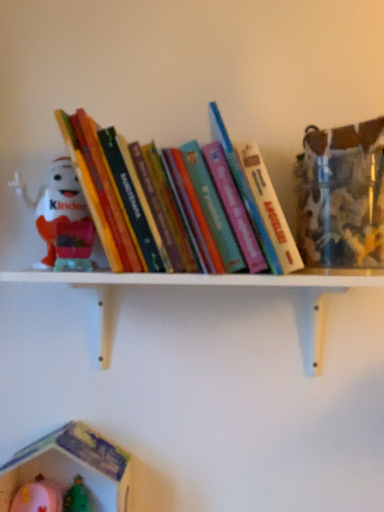
Question: From a real-world perspective, is white wooden shelf at upper center on matte plastic kinder egg at left, positioned as the 2th toy in bottom-to-top order?

Choices:
 (A) yes
 (B) no

Answer: (B)

Question: Considering the relative sizes of white wooden shelf at upper center and matte plastic kinder egg at left, positioned as the 2th toy in bottom-to-top order, in the image provided, is white wooden shelf at upper center taller than matte plastic kinder egg at left, positioned as the 2th toy in bottom-to-top order,?

Choices:
 (A) no
 (B) yes

Answer: (A)

Question: Considering the relative positions of white wooden shelf at upper center and matte plastic kinder egg at left, the 1th toy when ordered from top to bottom, in the image provided, is white wooden shelf at upper center in front of matte plastic kinder egg at left, the 1th toy when ordered from top to bottom,?

Choices:
 (A) no
 (B) yes

Answer: (B)

Question: Can matte plastic kinder egg at left, positioned as the 2th toy in bottom-to-top order, be found inside white wooden shelf at upper center?

Choices:
 (A) no
 (B) yes

Answer: (A)

Question: Is the depth of white wooden shelf at upper center greater than that of matte plastic kinder egg at left, positioned as the 2th toy in bottom-to-top order?

Choices:
 (A) no
 (B) yes

Answer: (A)

Question: From the image's perspective, is plastic toy house at lower left, positioned as the 2th toy in top-to-bottom order, located above or below hardcover books at center?

Choices:
 (A) below
 (B) above

Answer: (A)

Question: From a real-world perspective, relative to hardcover books at center, is plastic toy house at lower left, marked as the 1th toy in a bottom-to-top arrangement, vertically above or below?

Choices:
 (A) below
 (B) above

Answer: (A)

Question: Is plastic toy house at lower left, positioned as the 2th toy in top-to-bottom order, taller or shorter than hardcover books at center?

Choices:
 (A) tall
 (B) short

Answer: (B)

Question: Considering the positions of point (125, 507) and point (109, 246), is point (125, 507) closer or farther from the camera than point (109, 246)?

Choices:
 (A) farther
 (B) closer

Answer: (A)

Question: Based on their positions, is white wooden shelf at upper center located to the left or right of plastic toy house at lower left, positioned as the 2th toy in top-to-bottom order?

Choices:
 (A) left
 (B) right

Answer: (B)

Question: Does point (319, 330) appear closer or farther from the camera than point (71, 488)?

Choices:
 (A) closer
 (B) farther

Answer: (A)

Question: Is white wooden shelf at upper center in front of or behind plastic toy house at lower left, positioned as the 2th toy in top-to-bottom order, in the image?

Choices:
 (A) behind
 (B) front

Answer: (B)

Question: From the image's perspective, is white wooden shelf at upper center above or below plastic toy house at lower left, positioned as the 2th toy in top-to-bottom order?

Choices:
 (A) above
 (B) below

Answer: (A)

Question: From a real-world perspective, is plastic toy house at lower left, marked as the 1th toy in a bottom-to-top arrangement, physically located above or below matte plastic kinder egg at left, the 1th toy when ordered from top to bottom?

Choices:
 (A) above
 (B) below

Answer: (B)

Question: From the image's perspective, is plastic toy house at lower left, marked as the 1th toy in a bottom-to-top arrangement, positioned above or below matte plastic kinder egg at left, the 1th toy when ordered from top to bottom?

Choices:
 (A) above
 (B) below

Answer: (B)